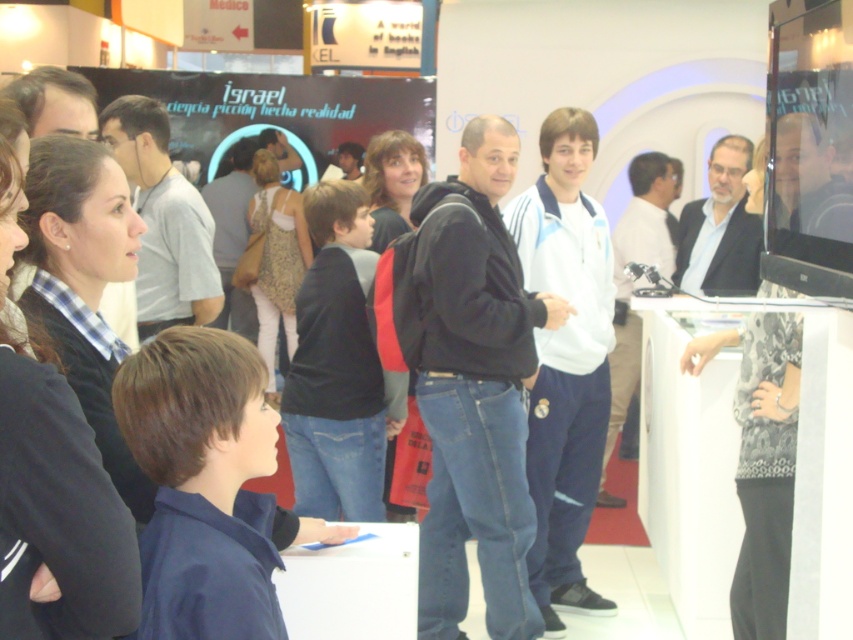
You are a photographer positioned at the center of the scene. You need to capture a photo that includes both the black matte jacket at center and the matte black jacket at upper left. What is the minimum distance you need to move backward to ensure both are in frame?

The black matte jacket at center is 4.88 feet from the matte black jacket at upper left. To include both in the frame, you need to move backward at least half of that distance, so approximately 2.44 feet.

You are standing at the entrance of the exhibition hall and see the matte black suit at upper right and the light brown leather jacket at center. Which clothing item is positioned lower in the image?

The matte black suit at upper right is below the light brown leather jacket at center, so the matte black suit at upper right is positioned lower in the image.